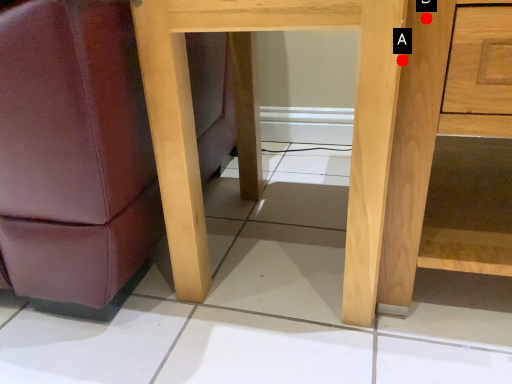
Question: Two points are circled on the image, labeled by A and B beside each circle. Among these points, which one is nearest to the camera?

Choices:
 (A) A is closer
 (B) B is closer

Answer: (B)